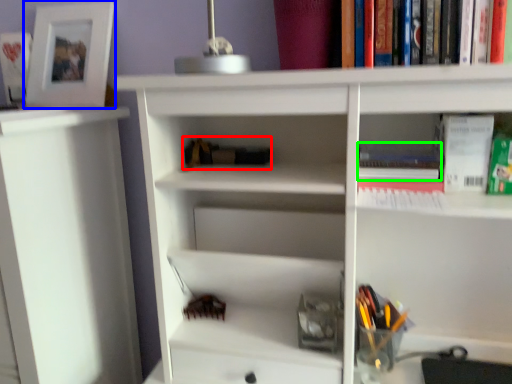
Question: Which object is the farthest from book (highlighted by a red box)? Choose among these: picture frame (highlighted by a blue box) or book (highlighted by a green box).

Choices:
 (A) picture frame
 (B) book

Answer: (A)